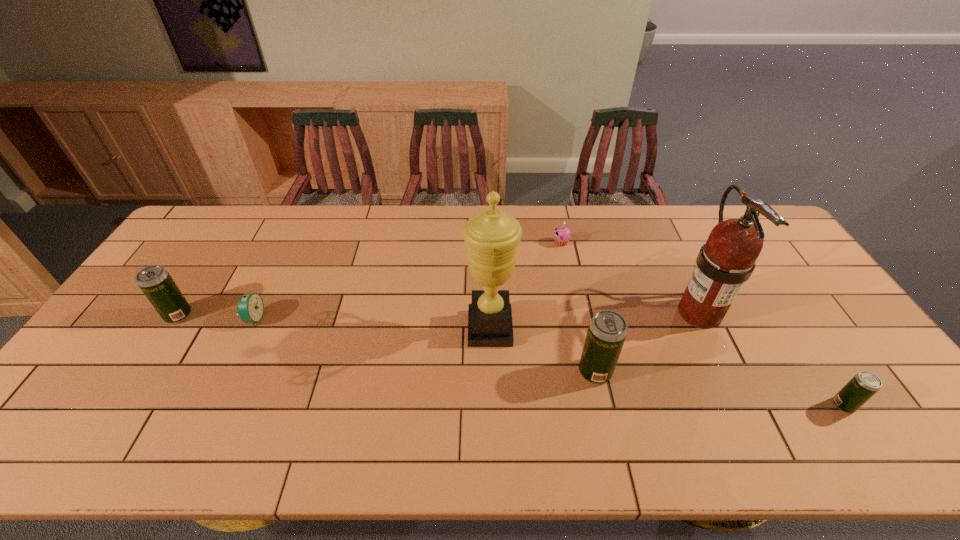
What are the coordinates of `object that is at the far edge` in the screenshot? It's located at (562, 234).

What are the coordinates of `object that is at the left edge` in the screenshot? It's located at (156, 283).

At what (x,y) coordinates should I click in order to perform the action: click on object located in the right edge section of the desktop. Please return your answer as a coordinate pair (x, y). The height and width of the screenshot is (540, 960). Looking at the image, I should click on (865, 384).

At what (x,y) coordinates should I click in order to perform the action: click on object that is at the near right corner. Please return your answer as a coordinate pair (x, y). Looking at the image, I should click on (865, 384).

This screenshot has width=960, height=540. In the image, there is a desktop. Identify the location of free region at the far edge. (604, 225).

I want to click on vacant position at the near edge of the desktop, so click(188, 397).

You are a GUI agent. You are given a task and a screenshot of the screen. Output one action in this format:
    pyautogui.click(x=<x>, y=<y>)
    Task: Click on the vacant space at the right edge of the desktop
    Image resolution: width=960 pixels, height=540 pixels.
    Given the screenshot: What is the action you would take?
    pyautogui.click(x=821, y=303)

Locate an element on the screen. The width and height of the screenshot is (960, 540). vacant space at the far left corner of the desktop is located at coordinates (234, 230).

Image resolution: width=960 pixels, height=540 pixels. In order to click on free space at the near left corner in this screenshot , I will do `click(64, 399)`.

In the image, there is a desktop. Where is `free space at the far right corner`? free space at the far right corner is located at coordinates (715, 213).